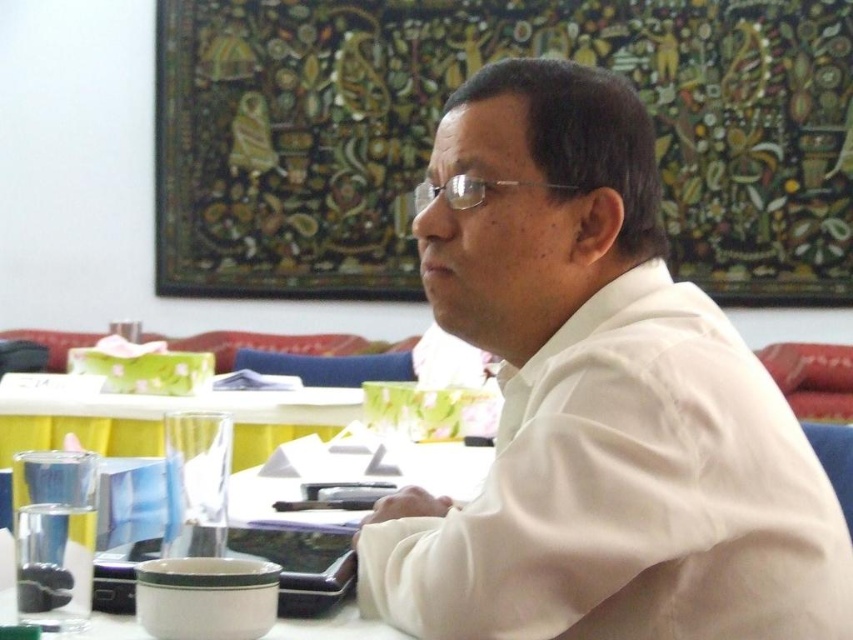
You are standing in the room and want to reach both points on the table. Which point, point (791,620) or point (440,193), is closer to you?

Point (791,620) is closer to the viewer than point (440,193).

Consider the image. You are an observer in the scene. You notice the white smooth shirt at center and the clear plastic glasses at center. Which object is positioned to the right of the other?

The white smooth shirt at center is to the right of clear plastic glasses at center.